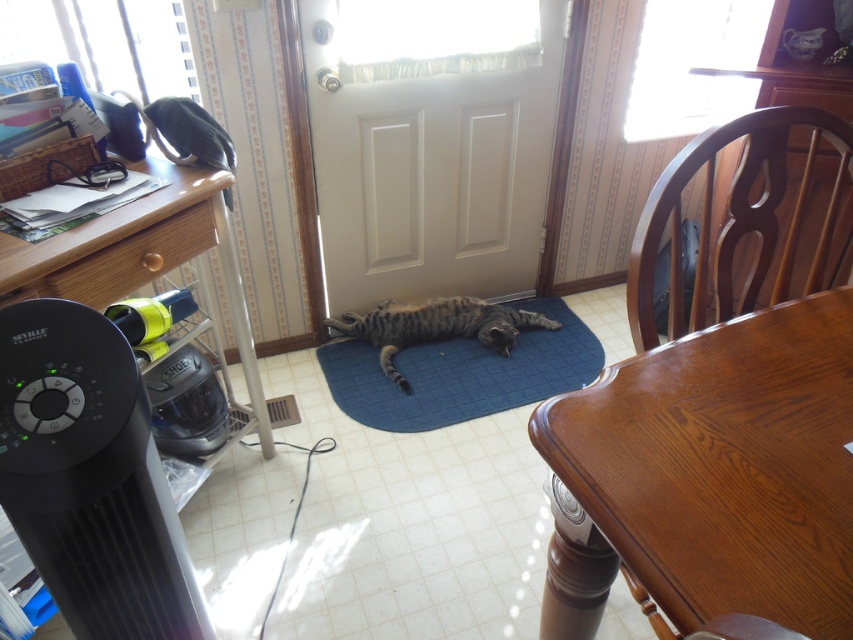
Is black plastic table at left taller than brown wood chair at right?

Correct, black plastic table at left is much taller as brown wood chair at right.

Which is more to the right, black plastic table at left or brown wood chair at right?

Positioned to the right is brown wood chair at right.

Identify the location of black plastic table at left. The height and width of the screenshot is (640, 853). (140, 257).

Who is taller, black plastic table at left or tabby fur cat at center?

black plastic table at left is taller.

From the picture: Who is more distant from viewer, [97,307] or [503,339]?

The point [503,339] is more distant.

Image resolution: width=853 pixels, height=640 pixels. I want to click on black plastic table at left, so click(140, 257).

Can you confirm if shiny brown wood table at lower right is bigger than tabby fur cat at center?

Correct, shiny brown wood table at lower right is larger in size than tabby fur cat at center.

Is shiny brown wood table at lower right smaller than tabby fur cat at center?

No.

Between point (799, 573) and point (387, 317), which one is positioned behind?

Positioned behind is point (387, 317).

Where is `shiny brown wood table at lower right`? shiny brown wood table at lower right is located at coordinates (711, 477).